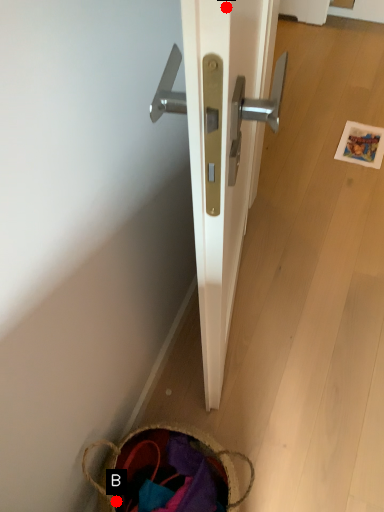
Question: Two points are circled on the image, labeled by A and B beside each circle. Which point is further to the camera?

Choices:
 (A) A is further
 (B) B is further

Answer: (B)